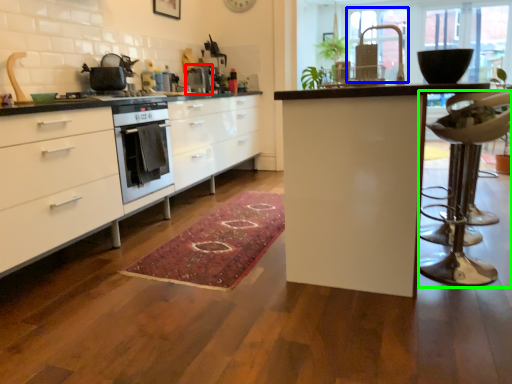
Question: Considering the real-world distances, which object is closest to appliance (highlighted by a red box)? window screen (highlighted by a blue box) or swivel chair (highlighted by a green box).

Choices:
 (A) window screen
 (B) swivel chair

Answer: (B)